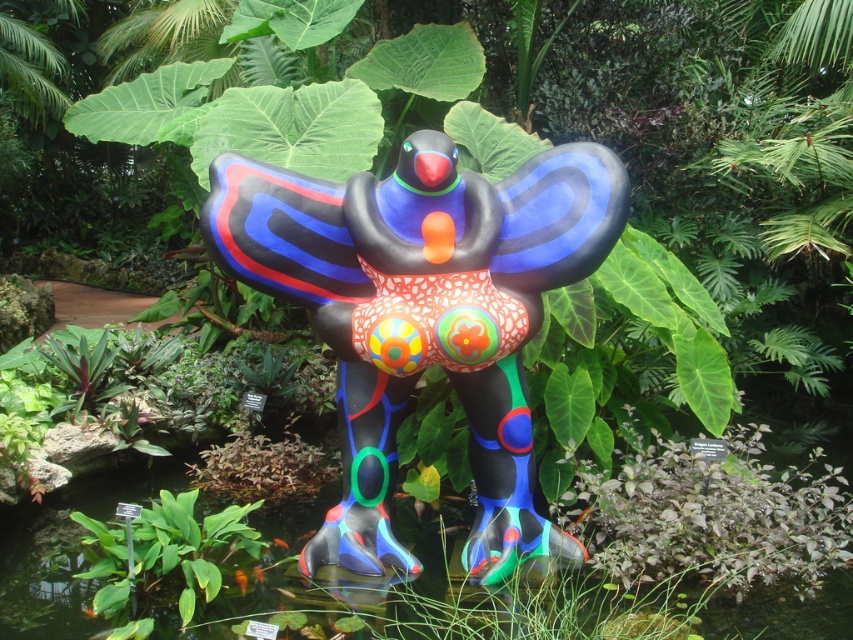
How much distance is there between glossy plastic bird at center and green leafy plant at lower center?

glossy plastic bird at center is 31.12 inches away from green leafy plant at lower center.

Identify the location of glossy plastic bird at center. (424, 314).